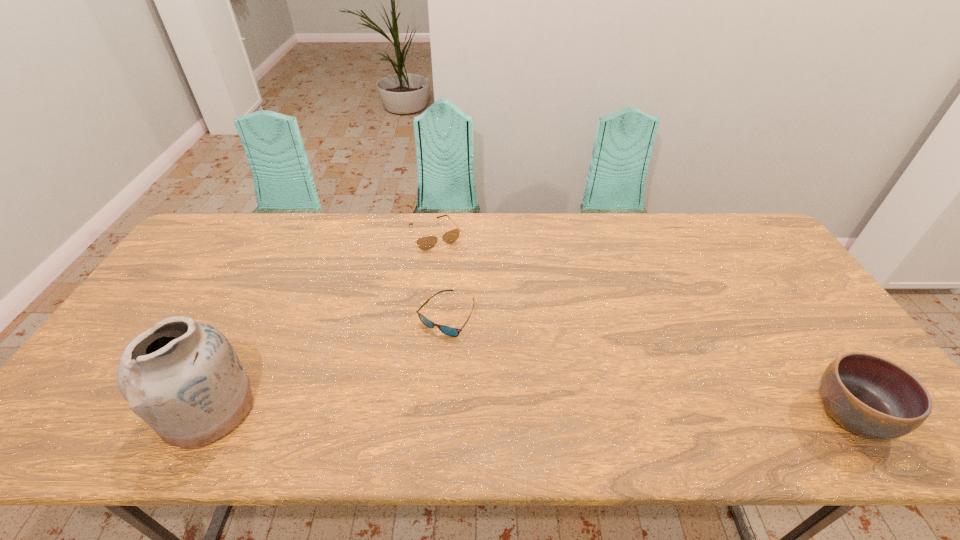
This screenshot has width=960, height=540. Identify the location of the leftmost object. (183, 378).

I want to click on pottery, so click(x=183, y=378).

What are the coordinates of `the third shortest object` in the screenshot? It's located at (866, 394).

This screenshot has width=960, height=540. I want to click on the rightmost object, so click(866, 394).

Locate an element on the screen. the taller sunglasses is located at coordinates (424, 243).

Locate an element on the screen. This screenshot has width=960, height=540. the farthest object is located at coordinates (424, 243).

You are a GUI agent. You are given a task and a screenshot of the screen. Output one action in this format:
    pyautogui.click(x=<x>, y=<y>)
    Task: Click on the shorter sunglasses
    The image size is (960, 540).
    Given the screenshot: What is the action you would take?
    pyautogui.click(x=449, y=331)

In order to click on the shortest object in this screenshot , I will do `click(449, 331)`.

Where is `vacant point located 0.180m on the right of the tallest object`? This screenshot has height=540, width=960. vacant point located 0.180m on the right of the tallest object is located at coordinates (331, 407).

Identify the location of vacant position located 0.290m on the front-facing side of the farthest object. (479, 310).